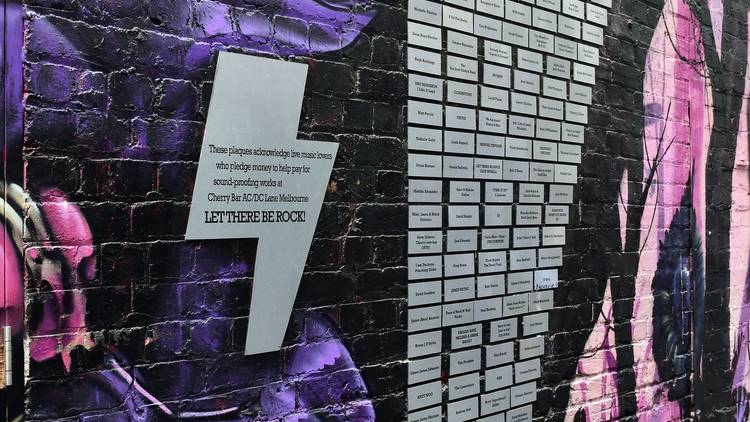
Locate an element on the screen. This screenshot has width=750, height=422. tree mural is located at coordinates (728, 112).